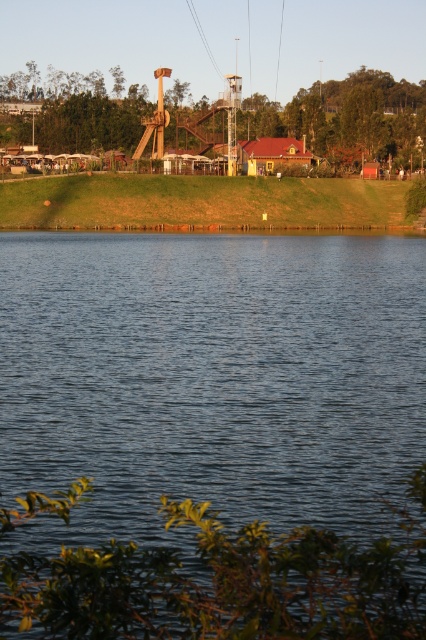
Question: Which object is closer to the camera taking this photo?

Choices:
 (A) black wire at upper center
 (B) blue water at center
 (C) rustic wooden slide at upper center

Answer: (B)

Question: Can you confirm if blue water at center is positioned above black wire at upper center?

Choices:
 (A) yes
 (B) no

Answer: (B)

Question: Considering the relative positions of rustic wooden slide at upper center and black wire at upper center in the image provided, where is rustic wooden slide at upper center located with respect to black wire at upper center?

Choices:
 (A) left
 (B) right

Answer: (B)

Question: Does blue water at center appear on the right side of black wire at upper center?

Choices:
 (A) yes
 (B) no

Answer: (A)

Question: Which point appears farthest from the camera in this image?

Choices:
 (A) (204, 49)
 (B) (394, 156)
 (C) (353, 339)

Answer: (A)

Question: Which point appears farthest from the camera in this image?

Choices:
 (A) (213, 54)
 (B) (368, 211)
 (C) (389, 502)

Answer: (A)